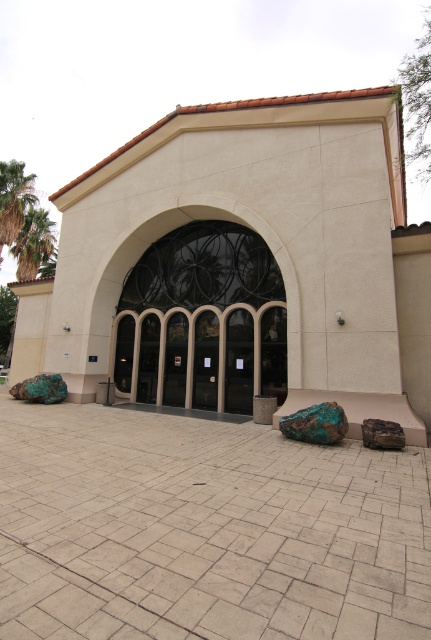
Question: Which of the following is the closest to the observer?

Choices:
 (A) beige stone archway at center
 (B) beige stucco chapel at center
 (C) green leafy palm tree at left
 (D) green leafy palm tree at upper left

Answer: (B)

Question: Which object is farther from the camera taking this photo?

Choices:
 (A) green leafy palm tree at upper left
 (B) beige stone archway at center
 (C) green rough stone at lower right
 (D) green patina stone at center

Answer: (A)

Question: Considering the relative positions of green leafy palm tree at left and green rough stone at lower right in the image provided, where is green leafy palm tree at left located with respect to green rough stone at lower right?

Choices:
 (A) above
 (B) below

Answer: (A)

Question: In this image, where is green leafy palm tree at upper left located relative to green rough stone at lower right?

Choices:
 (A) above
 (B) below

Answer: (A)

Question: Among these objects, which one is farthest from the camera?

Choices:
 (A) green rough stone at lower right
 (B) green leafy palm tree at upper left
 (C) beige stucco chapel at center

Answer: (B)

Question: Is green leafy palm tree at upper left bigger than green leafy palm tree at left?

Choices:
 (A) no
 (B) yes

Answer: (B)